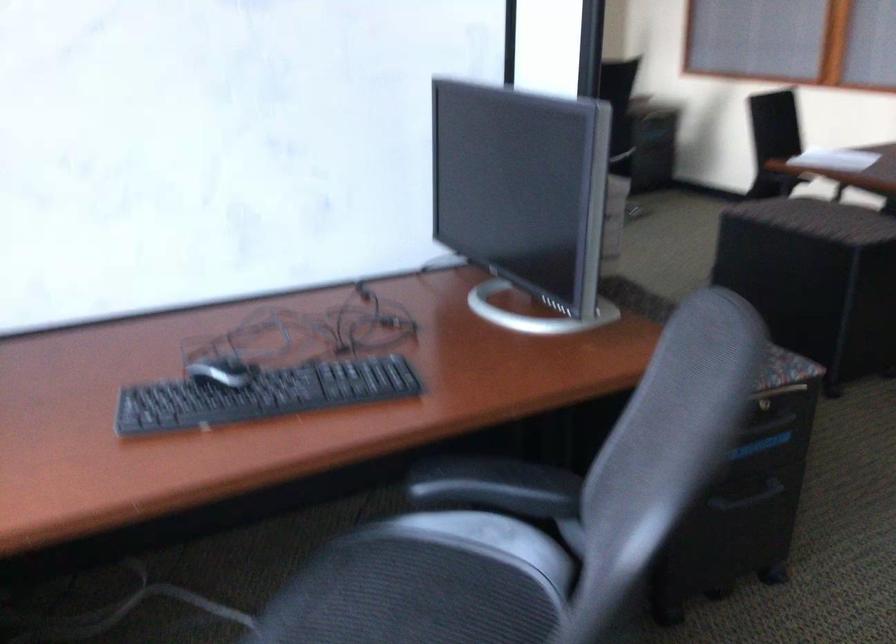
Image resolution: width=896 pixels, height=644 pixels. I want to click on chair sitting surface, so click(x=410, y=596).